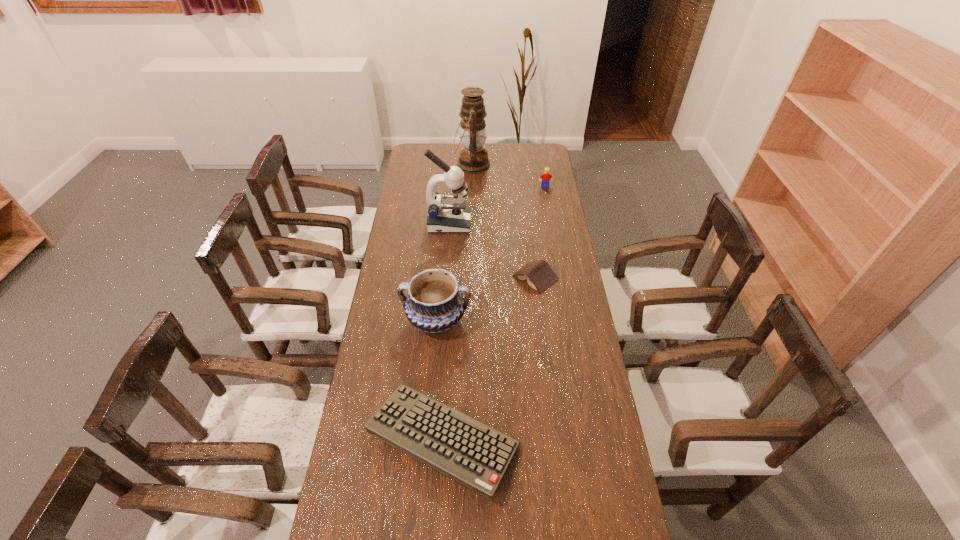
The width and height of the screenshot is (960, 540). I want to click on the farthest object, so click(473, 158).

Identify the location of microscope. The width and height of the screenshot is (960, 540). (447, 214).

The image size is (960, 540). In order to click on the second nearest object in this screenshot , I will do `click(435, 303)`.

Find the location of `pottery`. pottery is located at coordinates (435, 303).

What are the coordinates of `the fifth nearest object` in the screenshot? It's located at (546, 176).

You are a GUI agent. You are given a task and a screenshot of the screen. Output one action in this format:
    pyautogui.click(x=<x>, y=<y>)
    Task: Click on the Lego
    The width and height of the screenshot is (960, 540).
    Given the screenshot: What is the action you would take?
    pyautogui.click(x=546, y=176)

At what (x,y) coordinates should I click in order to perform the action: click on computer keyboard. Please return your answer as a coordinate pair (x, y). Looking at the image, I should click on (464, 449).

Locate an element on the screen. the nearest object is located at coordinates (464, 449).

Where is `the shortest object`? the shortest object is located at coordinates (539, 275).

Locate an element on the screen. The width and height of the screenshot is (960, 540). book is located at coordinates (539, 275).